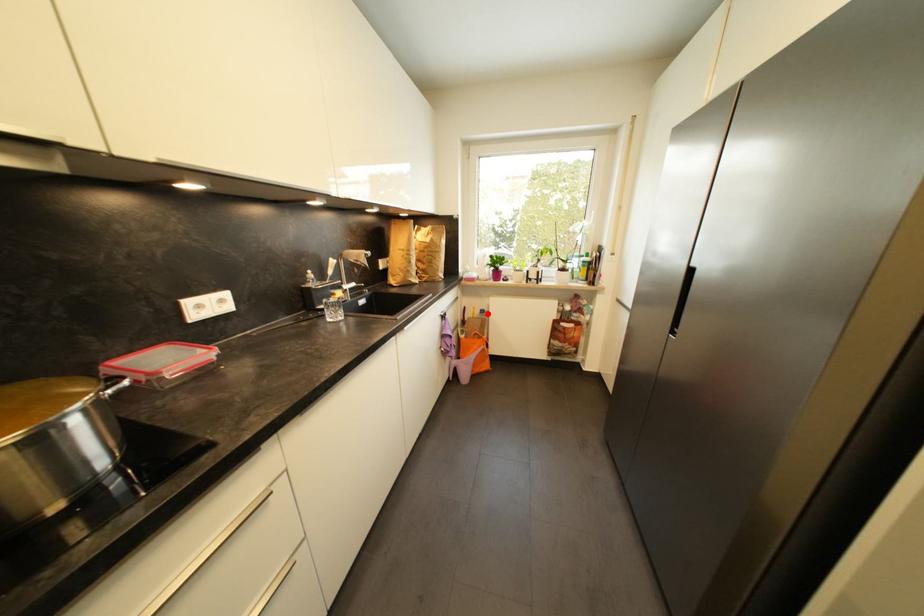
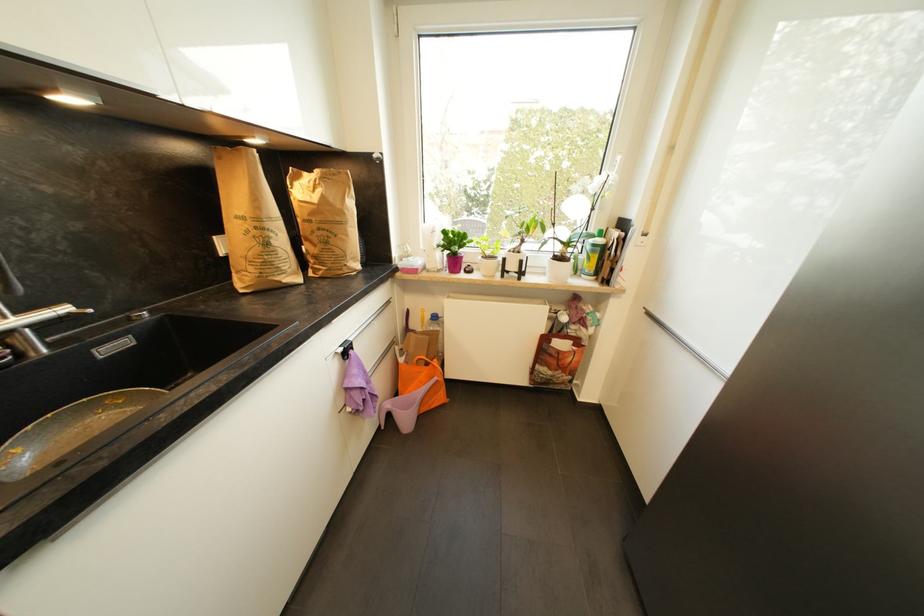
Find the pixel in the second image that matches the highlighted location in the first image.

(440, 320)